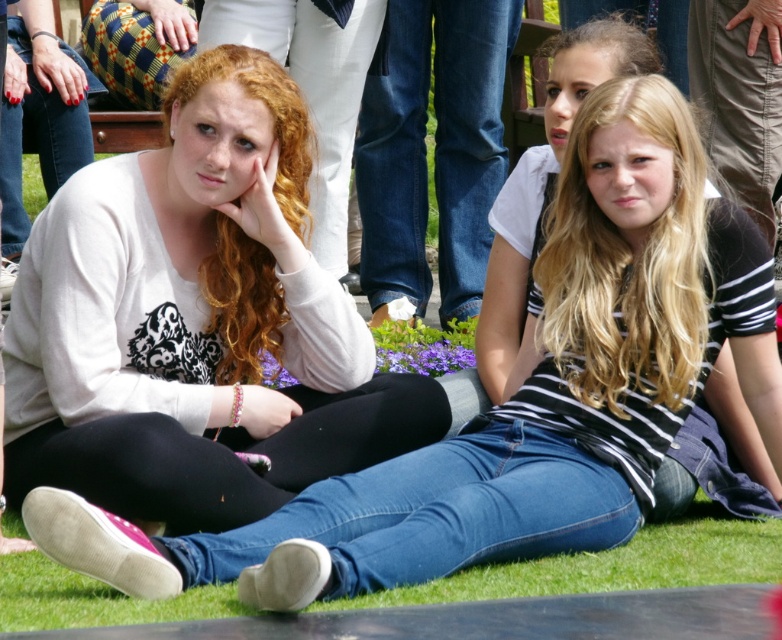
You are standing 10 meters away from the white matte shirt at center. Can you reach it without moving?

The white matte shirt at center is 11.47 meters from viewer, so you are 10 meters away. Since the shirt is 1.47 meters further away than your current position, you cannot reach it without moving closer.

You are a photographer trying to capture the best angle of the striped cotton shirt at center and the green grass at lower center. Since you want to ensure both elements are visible, which object should you focus on first considering their heights?

The striped cotton shirt at center has a greater height compared to green grass at lower center, so you should focus on the striped cotton shirt at center first to ensure it is in frame before adjusting for the green grass at lower center.

You are a photographer trying to capture a closeup of the white matte shirt at center without including the green grass at lower center in the frame. Considering their widths, is this possible?

The white matte shirt at center is wider than the green grass at lower center, so it might be challenging to frame the white matte shirt at center without including the green grass at lower center due to its narrower width.